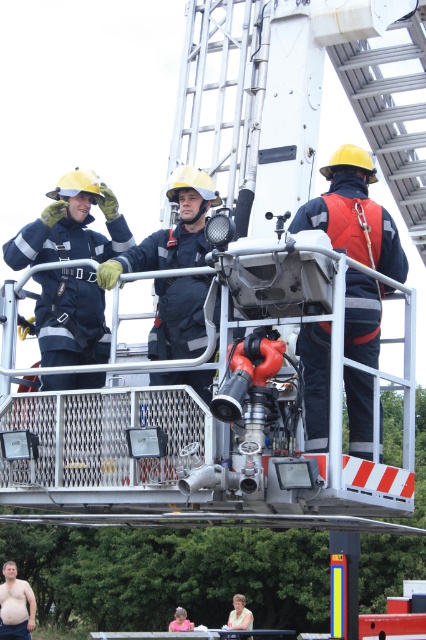
Does orange reflective vest at center have a greater height compared to pink fabric shirt at lower center?

Indeed, orange reflective vest at center has a greater height compared to pink fabric shirt at lower center.

Does point (368, 228) come farther from viewer compared to point (180, 618)?

No, (368, 228) is closer to viewer.

Find the location of `orange reflective vest at center`. orange reflective vest at center is located at coordinates (354, 214).

Is skinny man at lower left thinner than yellow hard hat at upper center?

Incorrect, skinny man at lower left's width is not less than yellow hard hat at upper center's.

Can you confirm if skinny man at lower left is taller than yellow hard hat at upper center?

Yes, skinny man at lower left is taller than yellow hard hat at upper center.

Does point (23, 628) come in front of point (239, 598)?

No, (23, 628) is further to viewer.

The image size is (426, 640). What are the coordinates of `skinny man at lower left` in the screenshot? It's located at (16, 605).

Is point (336, 188) farther from camera compared to point (5, 634)?

No, it is in front of (5, 634).

Does orange reflective vest at center have a greater height compared to skinny man at lower left?

Yes, orange reflective vest at center is taller than skinny man at lower left.

Does point (354, 150) come behind point (8, 600)?

No, it is not.

Identify the location of orange reflective vest at center. This screenshot has width=426, height=640. (354, 214).